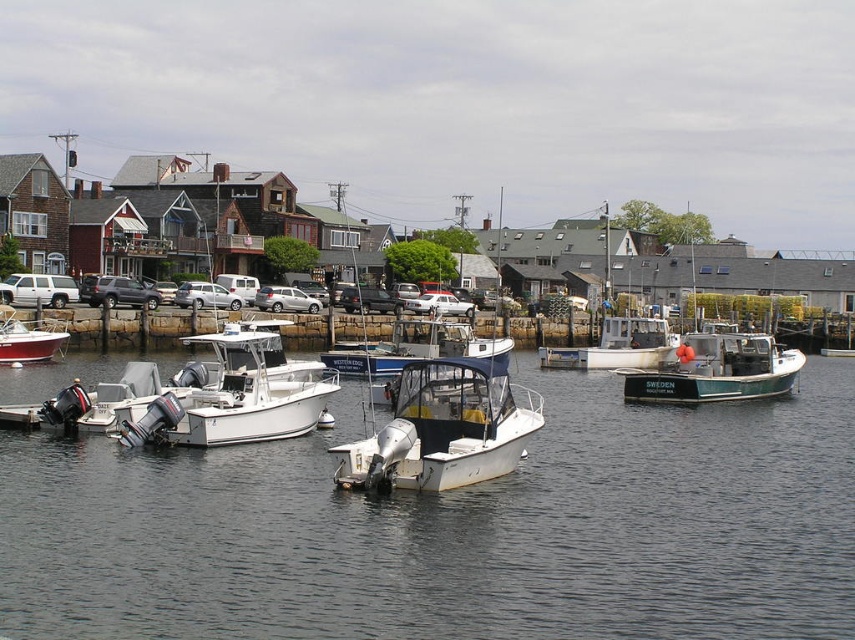
You are standing on the pier and want to board the white matte motorboat at left. The safety regulations state that you must be at least 50 meters away from the boat to avoid damaging it. Are you within the safe distance?

The white matte motorboat at left is 47.50 meters from the viewer. Since you are standing on the pier and the boat is only 47.50 meters away, you are within 50 meters, so you are not at a safe distance according to the regulations.

You are standing at the edge of the pier looking out at the boats and the houses in the background. There are two points marked on the image, one at coordinates point (444, 579) and the other at point (671, 333). Which point is closer to you?

Point (444, 579) is closer to the camera than point (671, 333).